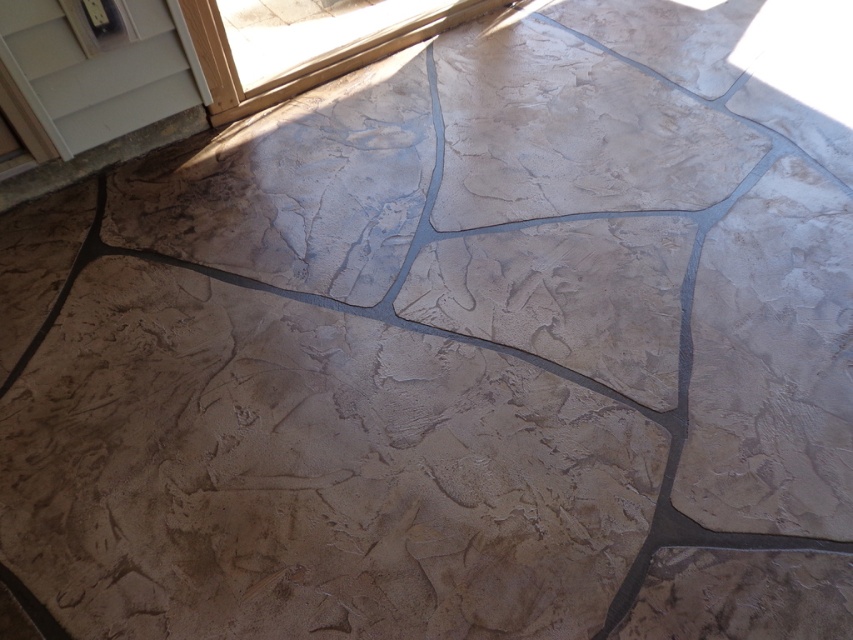
You are a delivery person trying to enter the house through the doors at the top left. The white painted wood screen door at upper left and the transparent glass door at upper left are both present. Which door is narrower in width?

The white painted wood screen door at upper left is narrower in width compared to the transparent glass door at upper left according to the description.

You are standing at the center of the floor and want to exit through the white painted wood screen door at upper left. Which direction should you walk to reach it?

You should walk towards the upper left direction to reach the white painted wood screen door at upper left, as it is located at point [99,68] which is the upper left corner of the frame.

You are standing in a room with a floor made of large, irregularly shaped tiles. You notice two doors at the upper left corner of the room. The doors are the white painted wood screen door at upper left and the transparent glass door at upper left. Which of these doors is smaller in size?

The white painted wood screen door at upper left is smaller than the transparent glass door at upper left according to the description.